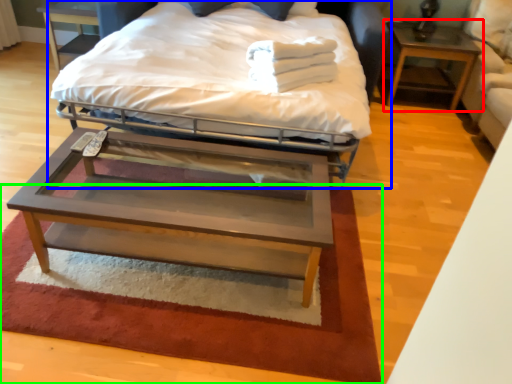
Question: Estimate the real-world distances between objects in this image. Which object is closer to nightstand (highlighted by a red box), bed (highlighted by a blue box) or mat (highlighted by a green box)?

Choices:
 (A) bed
 (B) mat

Answer: (A)